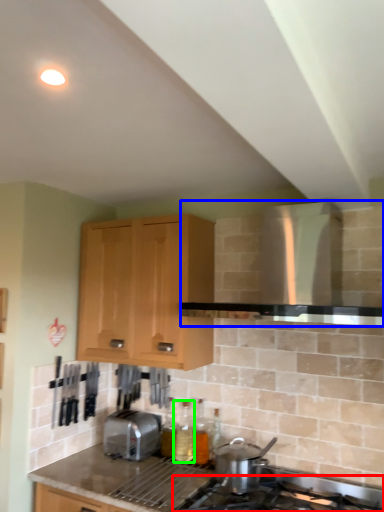
Question: Which object is positioned closest to gas stove (highlighted by a red box)? Select from vent (highlighted by a blue box) and bottle (highlighted by a green box).

Choices:
 (A) vent
 (B) bottle

Answer: (B)